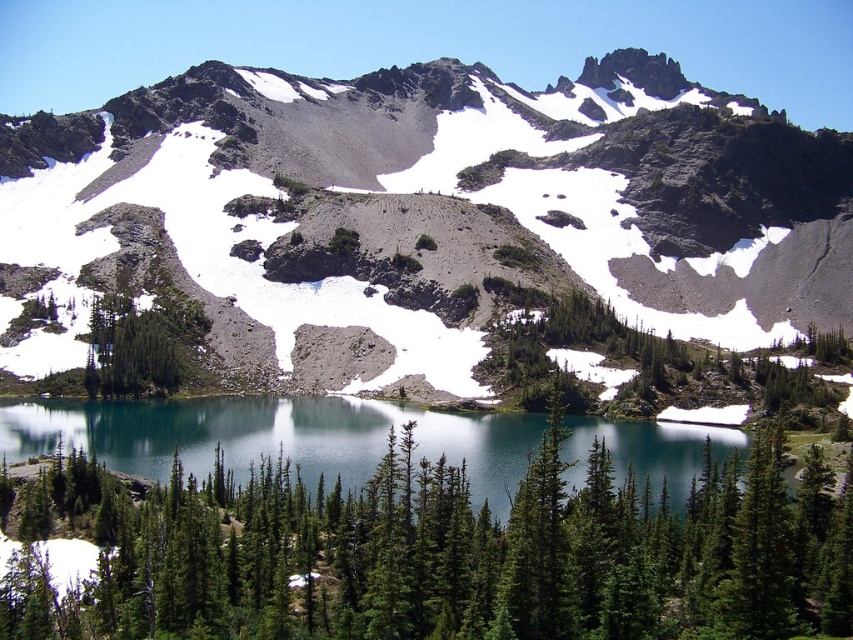
Question: Is green matte tree at center below green glassy water at center?

Choices:
 (A) yes
 (B) no

Answer: (B)

Question: Estimate the real-world distances between objects in this image. Which object is farther from the green matte tree at center-left?

Choices:
 (A) green glassy water at center
 (B) green matte tree at center

Answer: (B)

Question: Is rugged granite mountain at center thinner than green glassy water at center?

Choices:
 (A) no
 (B) yes

Answer: (A)

Question: Among these points, which one is nearest to the camera?

Choices:
 (A) (186, 317)
 (B) (654, 224)

Answer: (A)

Question: Does green matte tree at center lie in front of green matte tree at center-left?

Choices:
 (A) no
 (B) yes

Answer: (B)

Question: Which of the following is the farthest from the observer?

Choices:
 (A) green matte tree at center-left
 (B) green matte tree at center

Answer: (A)